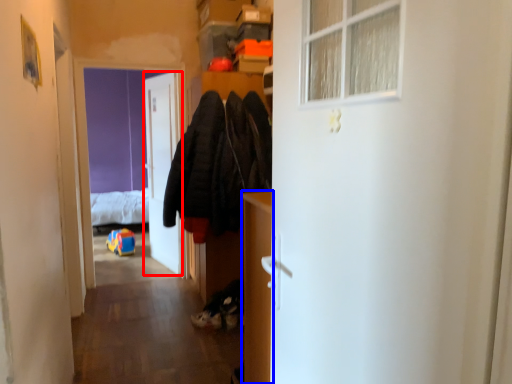
Question: Which point is closer to the camera, door (highlighted by a red box) or cabinetry (highlighted by a blue box)?

Choices:
 (A) door
 (B) cabinetry

Answer: (B)